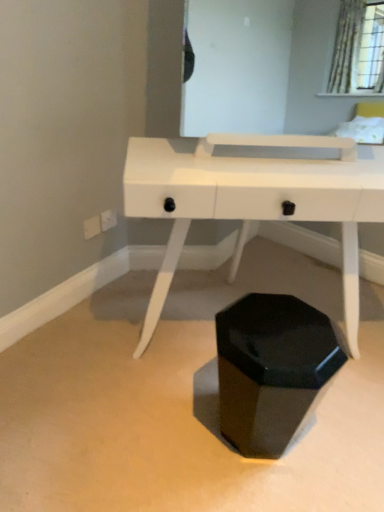
You are a GUI agent. You are given a task and a screenshot of the screen. Output one action in this format:
    pyautogui.click(x=<x>, y=<y>)
    Task: Click on the vacant space situated on the left part of white glossy desk at center
    Image resolution: width=384 pixels, height=512 pixels.
    Given the screenshot: What is the action you would take?
    pyautogui.click(x=86, y=386)